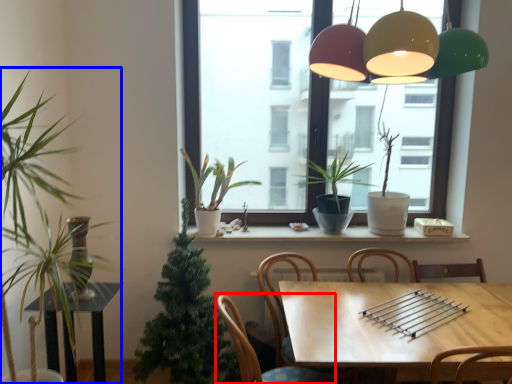
Question: Which point is closer to the camera, chair (highlighted by a red box) or houseplant (highlighted by a blue box)?

Choices:
 (A) chair
 (B) houseplant

Answer: (B)